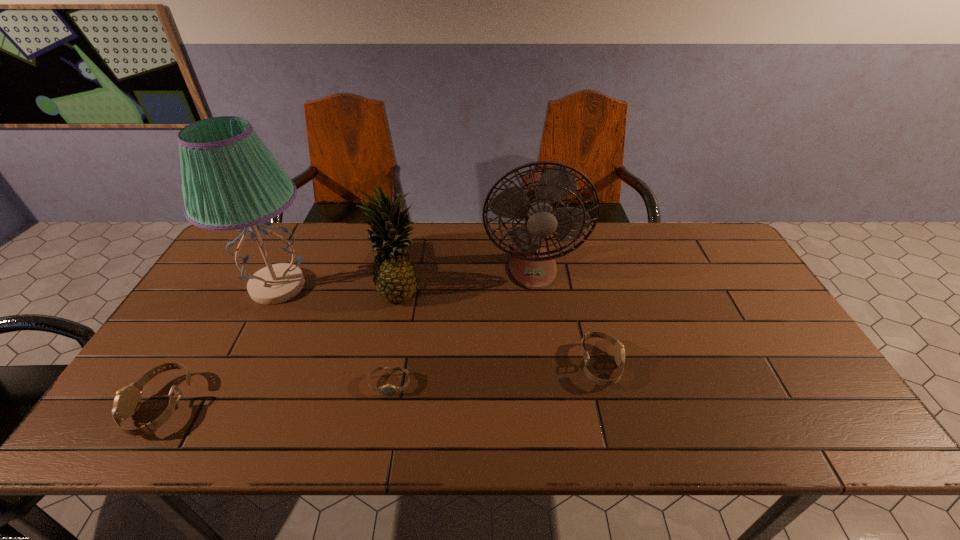
The height and width of the screenshot is (540, 960). Identify the location of free space located 0.100m on the back of the tallest object. (301, 240).

This screenshot has height=540, width=960. What are the coordinates of `vacant position located on the front of the pineapple` in the screenshot? It's located at (382, 381).

Where is `fan present at the far edge`? This screenshot has height=540, width=960. fan present at the far edge is located at coordinates (531, 265).

The image size is (960, 540). I want to click on lamp present at the far edge, so click(230, 180).

Identify the location of watch that is at the left edge. (127, 401).

The image size is (960, 540). Identify the location of lamp positioned at the left edge. (230, 180).

The width and height of the screenshot is (960, 540). I want to click on object at the far left corner, so [230, 180].

Identify the location of object present at the near left corner. The image size is (960, 540). (127, 401).

At what (x,y) coordinates should I click in order to perform the action: click on free space at the far edge of the desktop. Please return your answer as a coordinate pair (x, y). Looking at the image, I should click on (343, 264).

Locate an element on the screen. vacant space at the near edge is located at coordinates (459, 402).